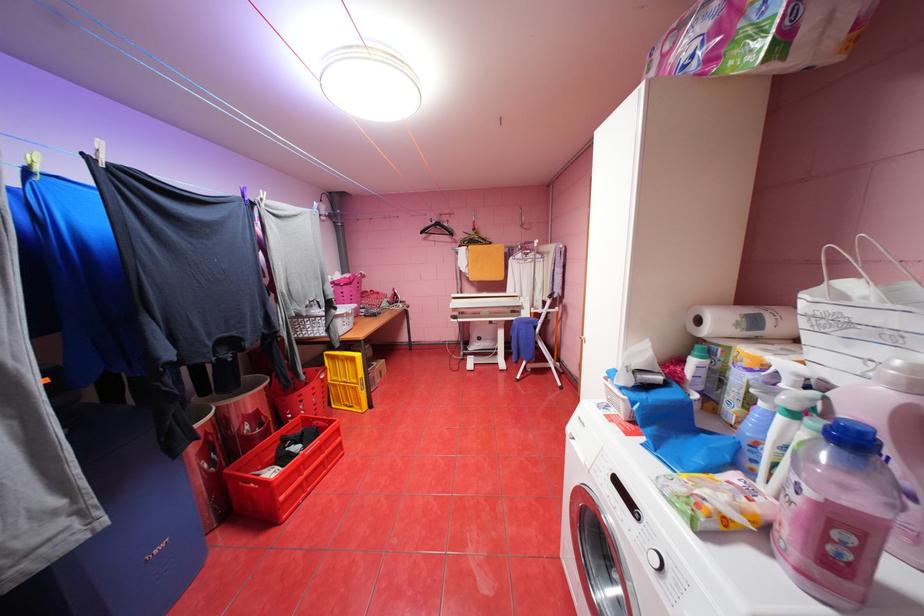
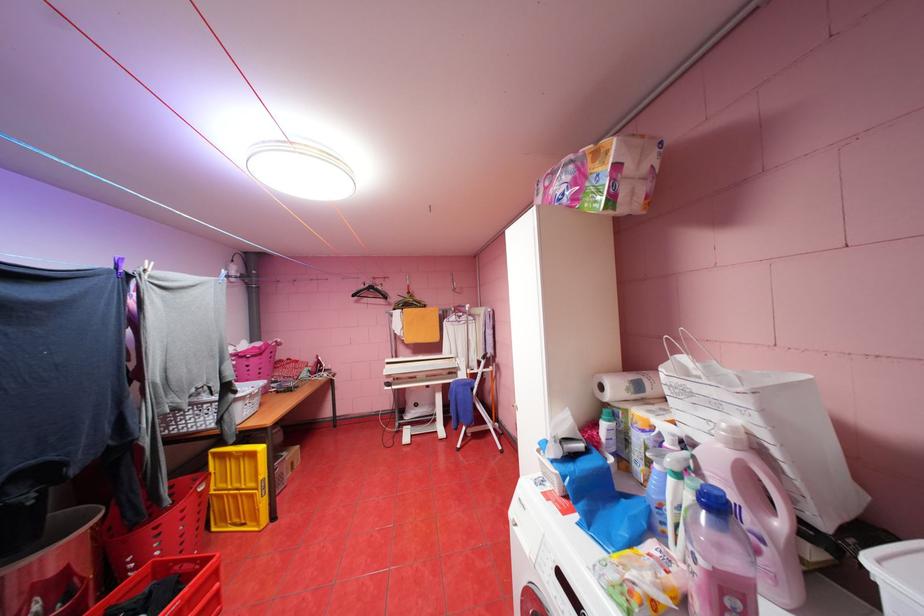
Locate, in the second image, the point that corresponds to point (862, 540) in the first image.

(748, 604)